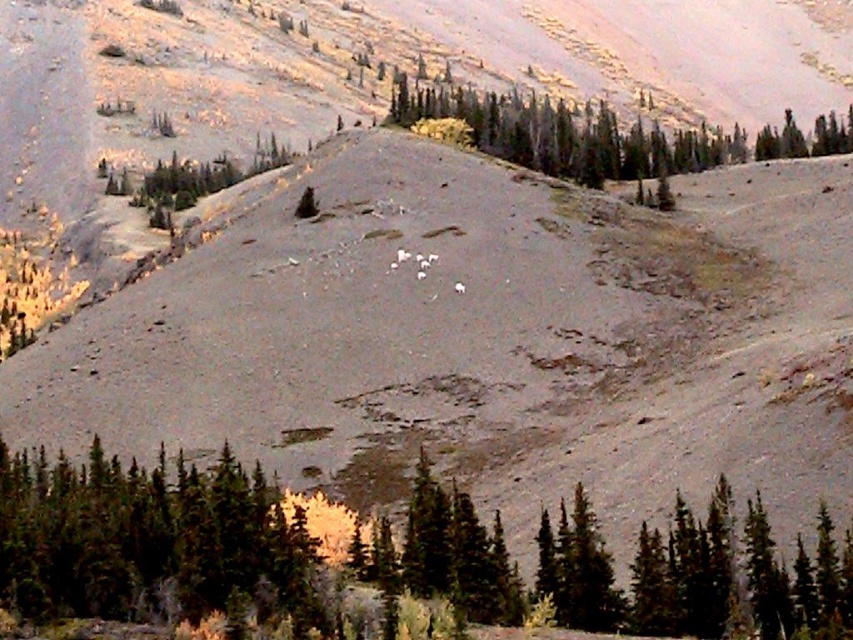
Looking at this image, you are a hiker standing at the base of the mountain and see the green matte tree at center and the green textured trees at upper center. Which tree group is closer to you?

The green matte tree at center is closer to the viewer than the green textured trees at upper center.

You are a hiker planning to take a photo of the green matte tree at center and the green textured trees at upper center. Which of these two groups of trees should you focus on first if you want to capture both in a single frame without moving your camera?

You should focus on the green textured trees at upper center first because they are larger in size compared to the green matte tree at center, allowing you to ensure they fit properly in the frame before adjusting for the smaller tree.

You are a hiker planning to take a photo of the green matte tree at center and the green textured trees at upper center. If you want to frame both in your camera, which direction should you adjust your camera to ensure both are visible?

You should adjust your camera to the left to include both the green matte tree at center and the green textured trees at upper center since the green matte tree at center is positioned to the left of the green textured trees at upper center.